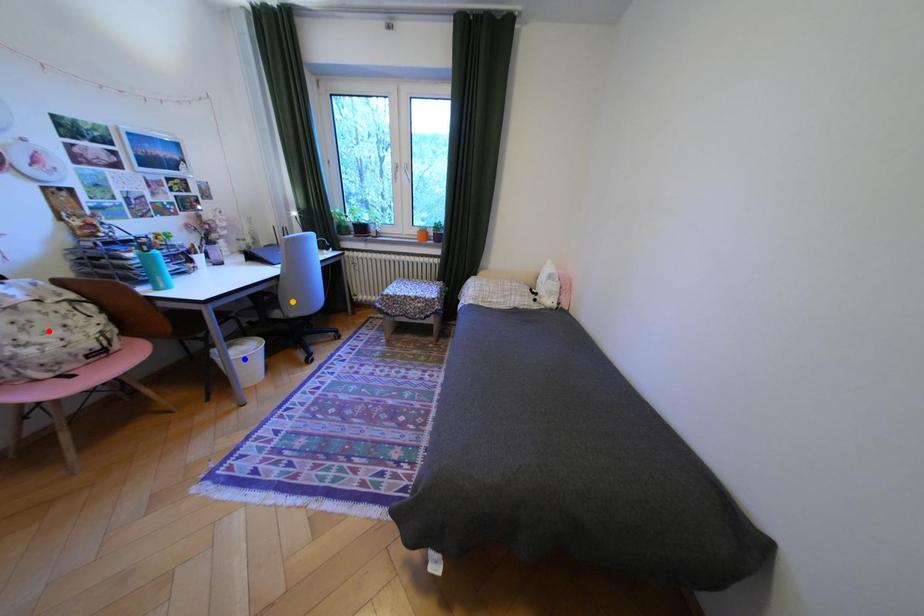
Order these from farthest to nearest:
1. red point
2. blue point
3. orange point

orange point
blue point
red point